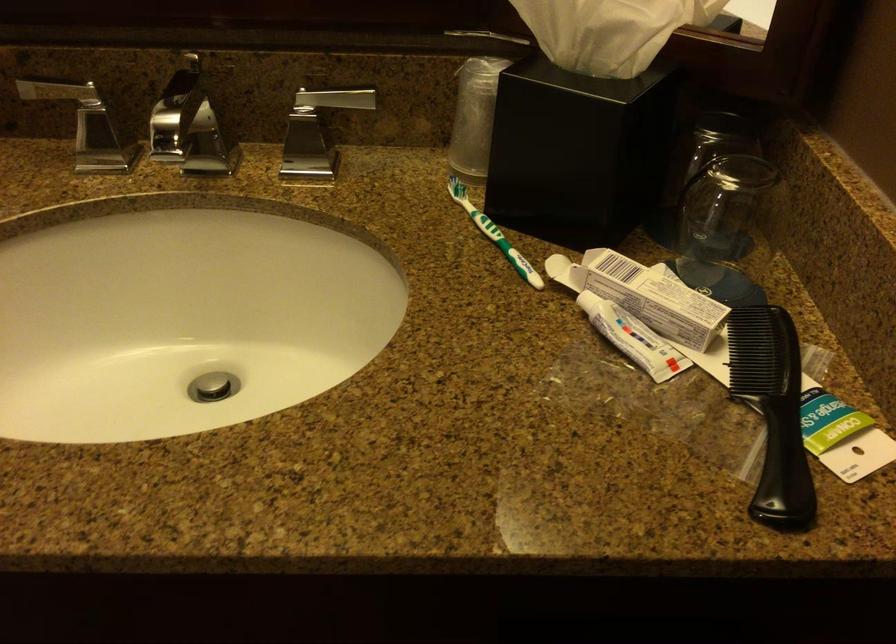
Where would you squeez the toothpaste tube? Please return your answer as a coordinate pair (x, y).

(633, 337)